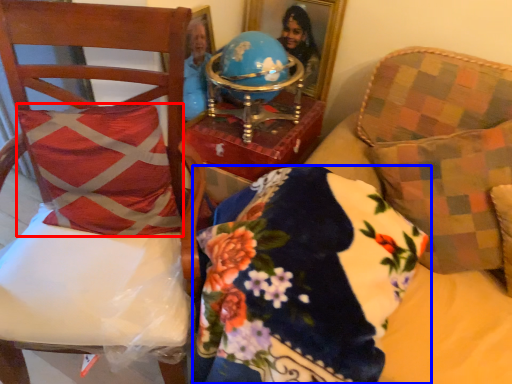
Question: Which of the following is the farthest to the observer, throw pillow (highlighted by a red box) or pillow (highlighted by a blue box)?

Choices:
 (A) throw pillow
 (B) pillow

Answer: (A)